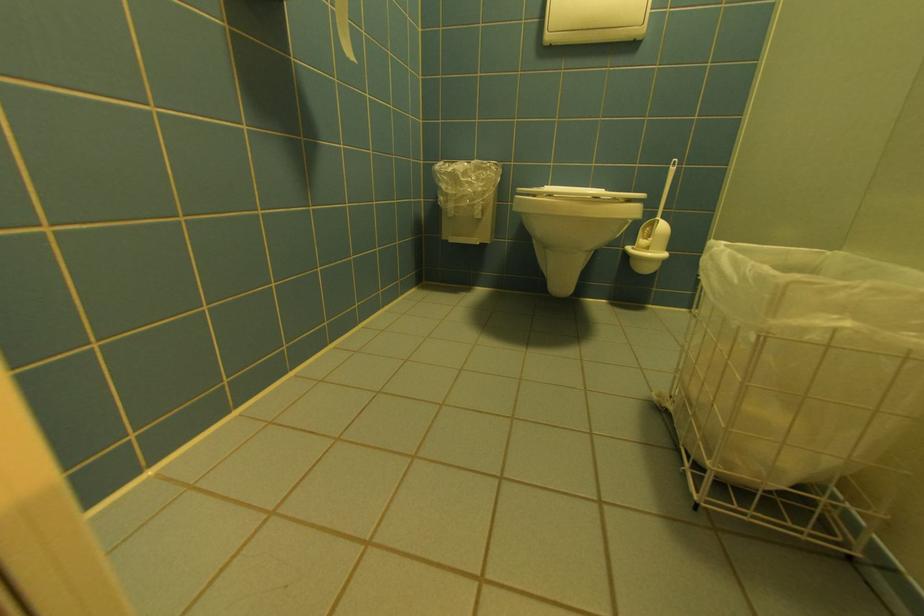
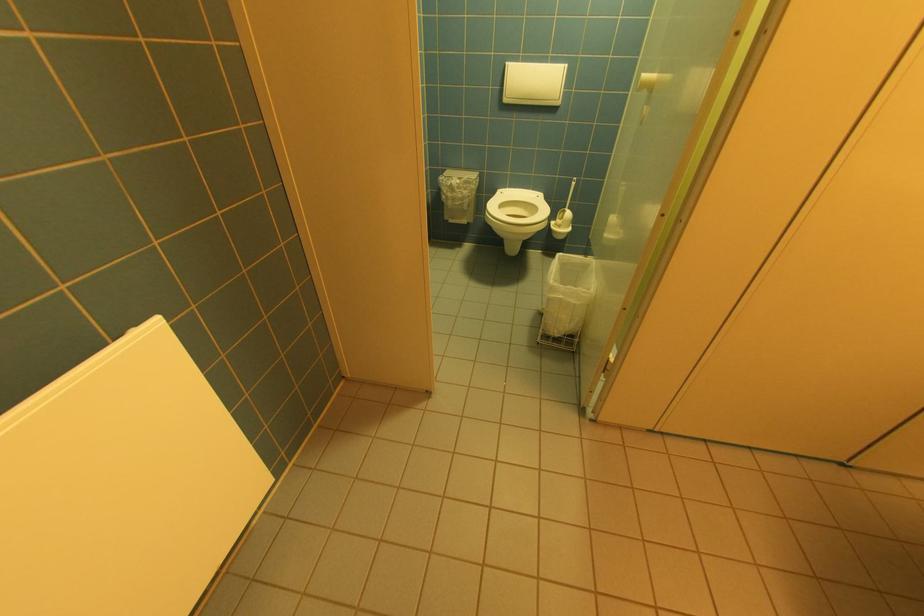
The point at (653, 229) is marked in the first image. Where is the corresponding point in the second image?

(567, 215)